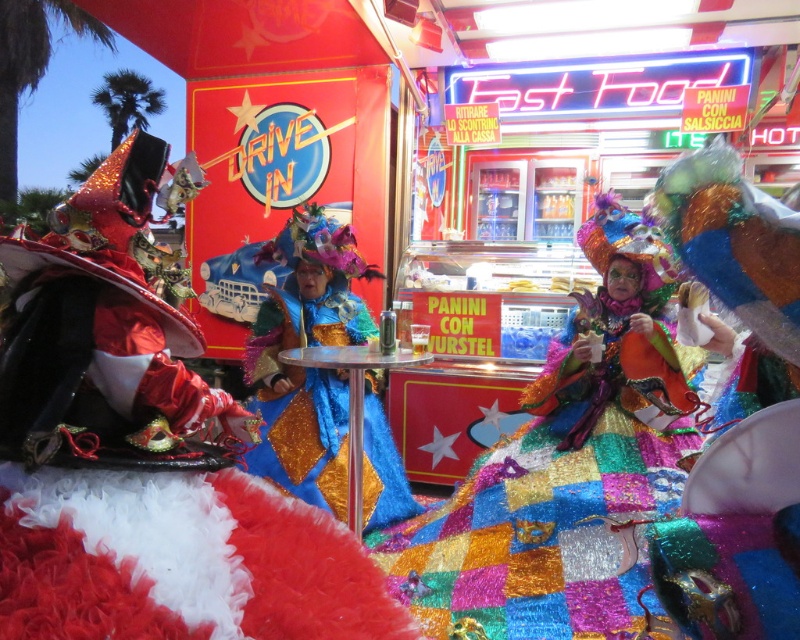
From the picture: Can you confirm if shiny sequined dress at center is smaller than shiny blue fabric dress at center?

No, shiny sequined dress at center is not smaller than shiny blue fabric dress at center.

Based on the photo, who is taller, shiny sequined dress at center or shiny blue fabric dress at center?

Standing taller between the two is shiny sequined dress at center.

Is point (544, 632) closer to camera compared to point (333, 266)?

Yes, point (544, 632) is in front of point (333, 266).

Locate an element on the screen. shiny sequined dress at center is located at coordinates (568, 468).

Who is taller, shiny red fabric at left or shiny sequined dress at center?

With more height is shiny sequined dress at center.

Is shiny red fabric at left further to camera compared to shiny sequined dress at center?

That is False.

Between point (258, 576) and point (602, 634), which one is positioned behind?

The point (602, 634) is behind.

Where is `shiny red fabric at left`? The height and width of the screenshot is (640, 800). shiny red fabric at left is located at coordinates click(144, 452).

Which is more to the right, shiny red fabric at left or shiny blue fabric dress at center?

Positioned to the right is shiny blue fabric dress at center.

Does shiny red fabric at left appear under shiny blue fabric dress at center?

Yes.

The height and width of the screenshot is (640, 800). Identify the location of shiny red fabric at left. (144, 452).